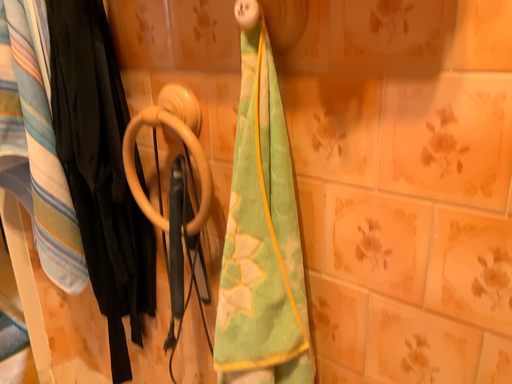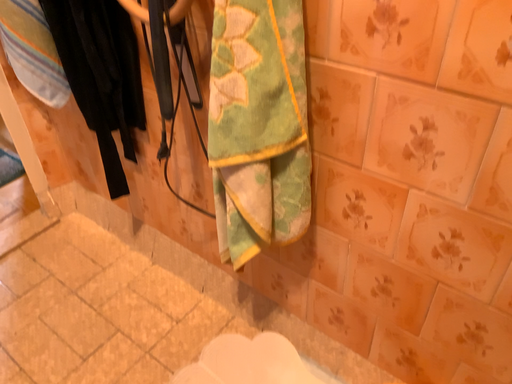
Question: Which way did the camera rotate in the video?

Choices:
 (A) rotated downward
 (B) rotated upward

Answer: (A)